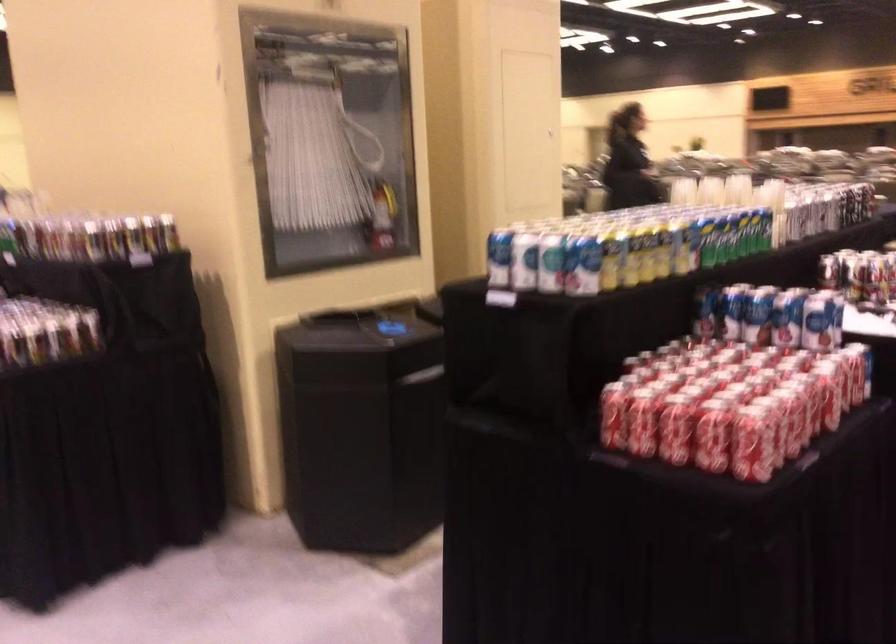
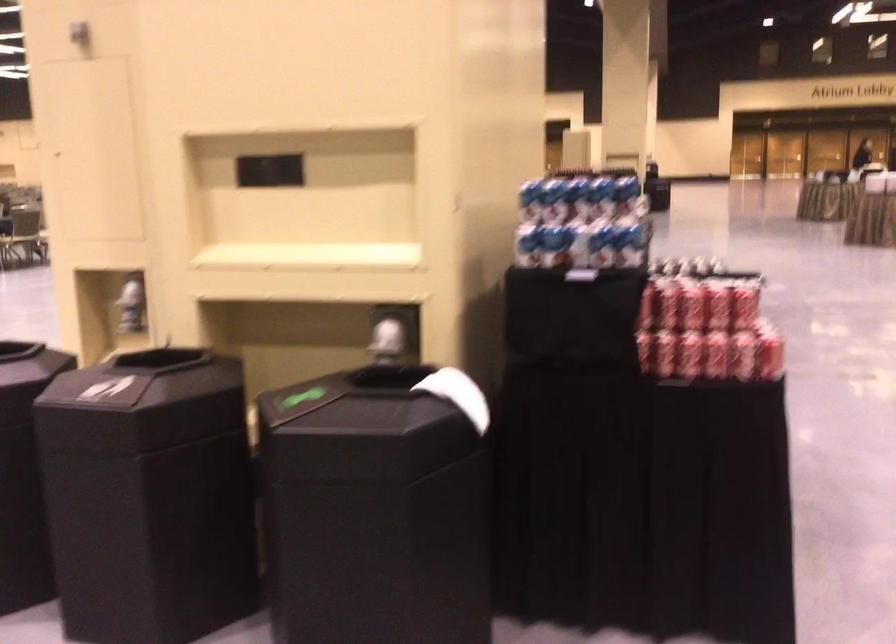
Question: I am providing you with two images of the same scene from different viewpoints. After the viewpoint changes to image2, which objects are now occluded?

Choices:
 (A) square glass dish
 (B) blue and white can
 (C) white paper towel
 (D) red soda can

Answer: (D)